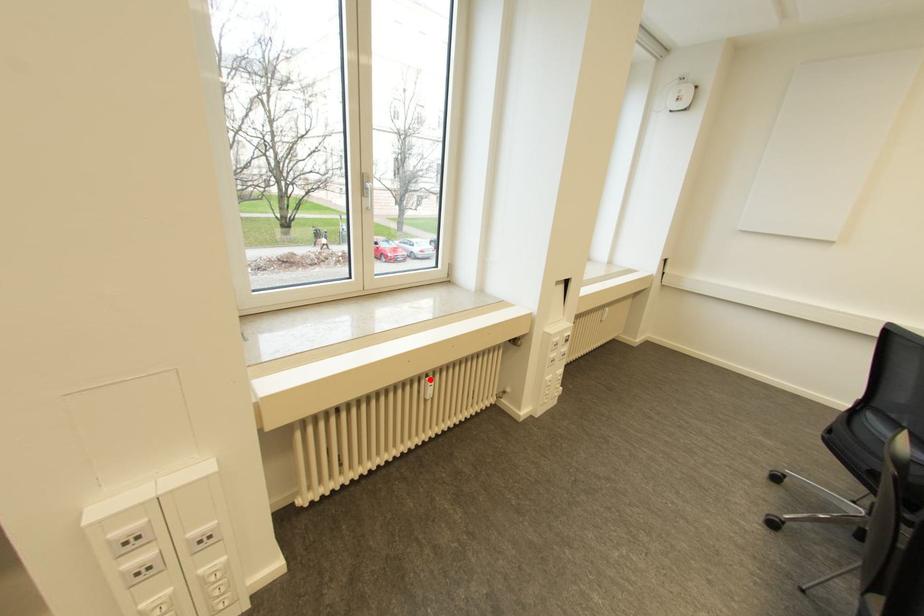
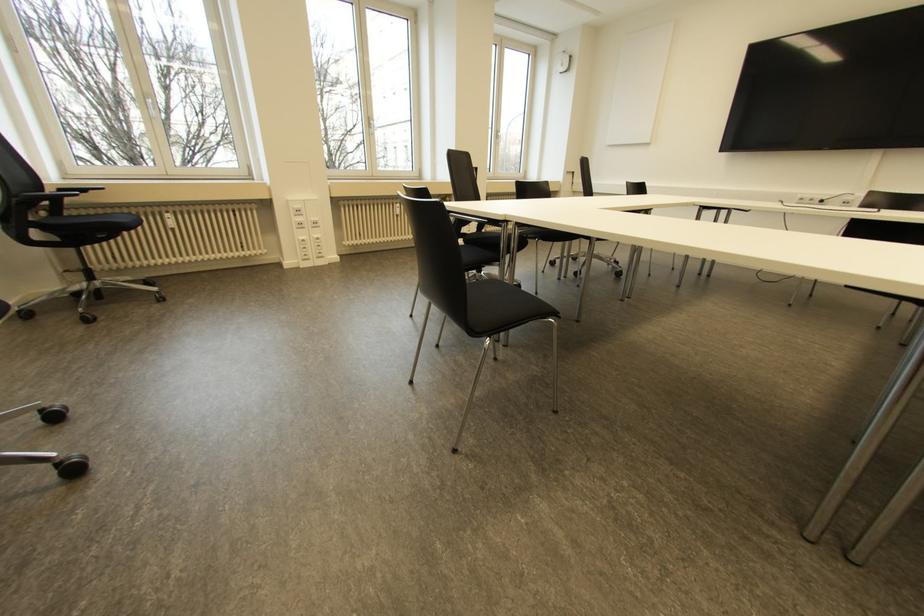
Question: I am providing you with two images of the same scene from different viewpoints. In image1, a red point is highlighted. Considering the same 3D point in image2, which of the following is correct?

Choices:
 (A) It is closer
 (B) It is farther

Answer: (A)